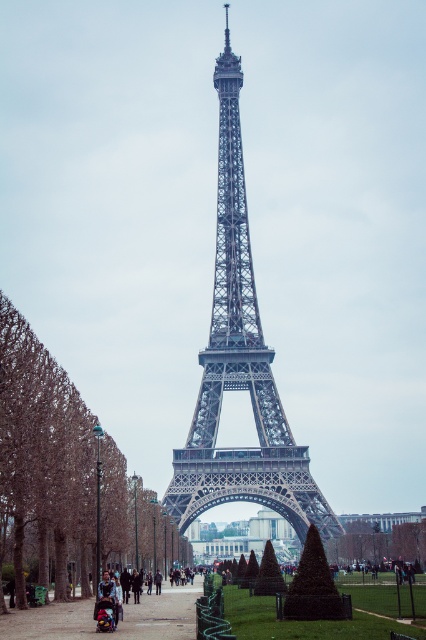
You are standing on the smooth asphalt path at center and want to take a photo of the metallic gray eiffel tower at center. Can you see the entire tower without any obstruction from the path?

The metallic gray eiffel tower at center is in front of the smooth asphalt path at center, so yes, you can see the entire tower without obstruction from the path.

You are standing on the smooth asphalt path at center and want to take a photo of the metallic gray eiffel tower at center. Which direction should you face to capture the tower in your shot?

You should face to the right to capture the metallic gray eiffel tower at center in your photo since it is located to the right of the smooth asphalt path at center.

Based on the photo, you are planning to place a 3 meter wide picnic blanket between the brown leafy tree at left and the smooth asphalt path at center. Which object will the blanket cover more of? Please explain your reasoning based on their widths.

The brown leafy tree at left has a lesser width compared to the smooth asphalt path at center. Since the picnic blanket is 3 meters wide, it will cover more of the smooth asphalt path at center because it is wider than the brown leafy tree at left.